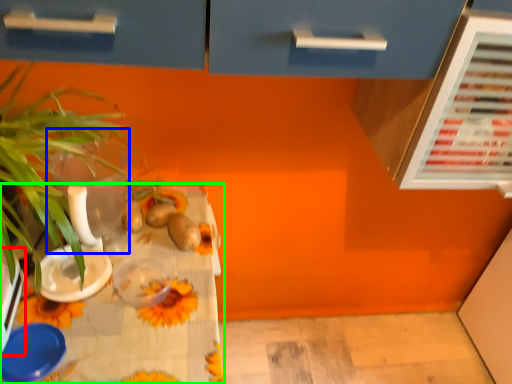
Question: Based on their relative distances, which object is farther from appliance (highlighted by a red box)? Choose from glass vase (highlighted by a blue box) and table (highlighted by a green box).

Choices:
 (A) glass vase
 (B) table

Answer: (A)